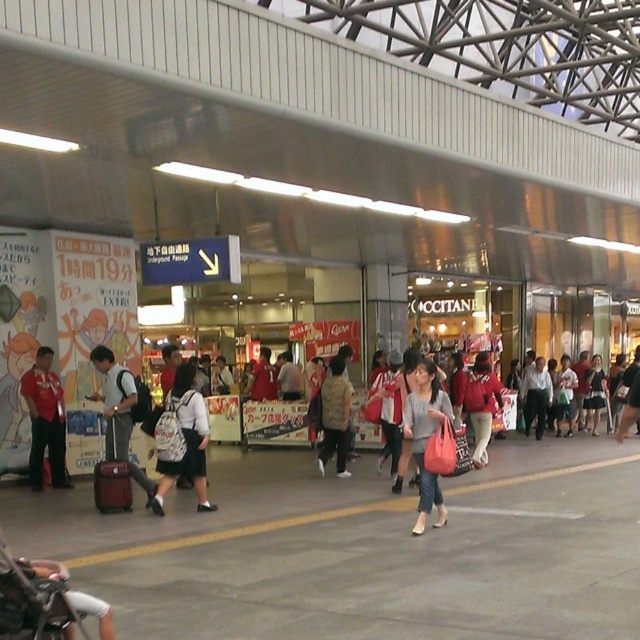
You are a customer in the shopping area and see the light gray fabric bag at center and the light brown backpack at center. Which one is positioned higher?

The light gray fabric bag at center is positioned higher than the light brown backpack at center.

You are a traveler in the shopping area and want to locate your friend who is wearing a matte red shirt at left and carrying a light brown backpack at center. From your current position, which item should you look for first to find them?

You should look for the matte red shirt at left first because it is in front of the light brown backpack at center, meaning your friend is closer to you when seen from the front.

You are a traveler who just arrived at the station and see the light brown backpack at center and the matte red jacket at center. Which item is closer to the floor?

The light brown backpack at center is positioned under the matte red jacket at center, so it is closer to the floor.